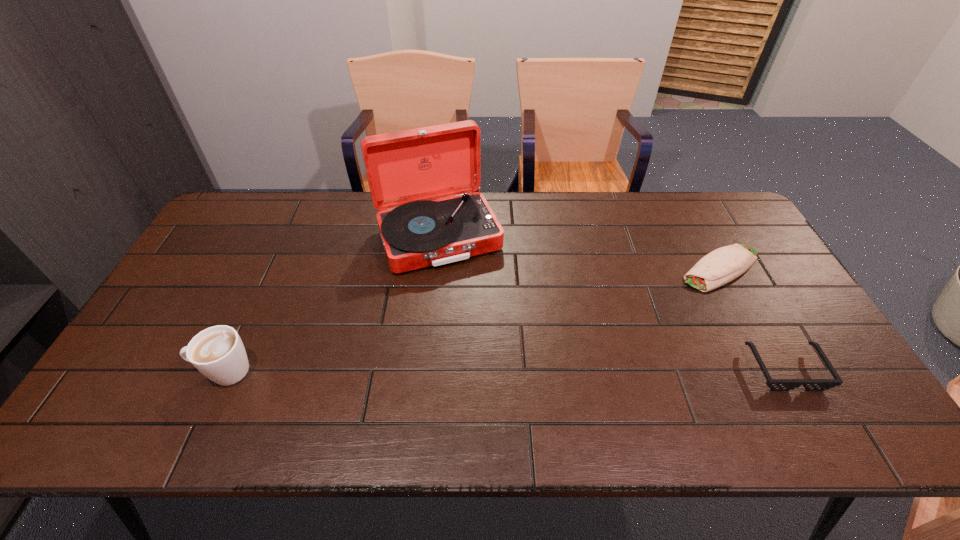
I want to click on free location located 0.150m on the front-facing side of the phonograph_record, so click(x=472, y=312).

The width and height of the screenshot is (960, 540). What are the coordinates of `vacant space located on the front-facing side of the phonograph_record` in the screenshot? It's located at (482, 334).

Locate an element on the screen. The height and width of the screenshot is (540, 960). vacant region located 0.280m on the front-facing side of the phonograph_record is located at coordinates (488, 348).

Locate an element on the screen. The width and height of the screenshot is (960, 540). object present at the far edge is located at coordinates (406, 169).

Where is `cappuccino at the near edge`? The image size is (960, 540). cappuccino at the near edge is located at coordinates 217,352.

You are a GUI agent. You are given a task and a screenshot of the screen. Output one action in this format:
    pyautogui.click(x=<x>, y=<y>)
    Task: Click on the sunglasses at the near edge
    
    Given the screenshot: What is the action you would take?
    pyautogui.click(x=774, y=384)

Where is `sunglasses that is at the right edge`? sunglasses that is at the right edge is located at coordinates (774, 384).

Locate an element on the screen. burrito present at the right edge is located at coordinates (719, 267).

Identify the location of object positioned at the near right corner. (x=774, y=384).

Where is `free region at the far edge`? free region at the far edge is located at coordinates tap(347, 210).